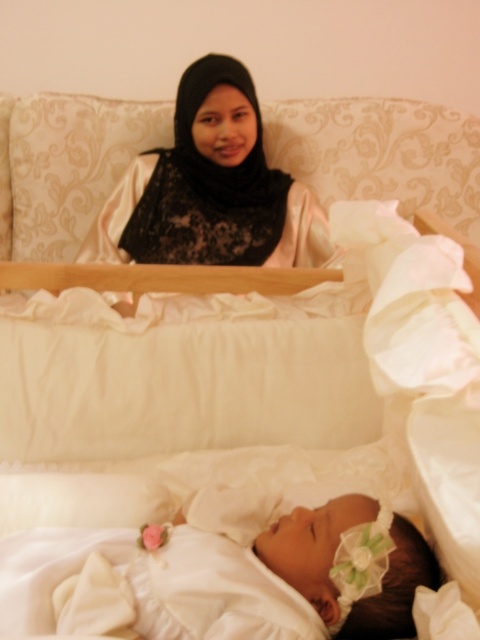
Question: Among these objects, which one is farthest from the camera?

Choices:
 (A) white satin dress at lower center
 (B) matte black hijab at upper center

Answer: (B)

Question: Considering the relative positions of white satin dress at lower center and matte black hijab at upper center in the image provided, where is white satin dress at lower center located with respect to matte black hijab at upper center?

Choices:
 (A) left
 (B) right

Answer: (B)

Question: Does white satin dress at lower center have a greater width compared to matte black hijab at upper center?

Choices:
 (A) no
 (B) yes

Answer: (A)

Question: Is white satin dress at lower center further to the viewer compared to matte black hijab at upper center?

Choices:
 (A) no
 (B) yes

Answer: (A)

Question: Which point appears closest to the camera in this image?

Choices:
 (A) (199, 131)
 (B) (163, 579)

Answer: (B)

Question: Which point appears closest to the camera in this image?

Choices:
 (A) (196, 532)
 (B) (299, 228)

Answer: (A)